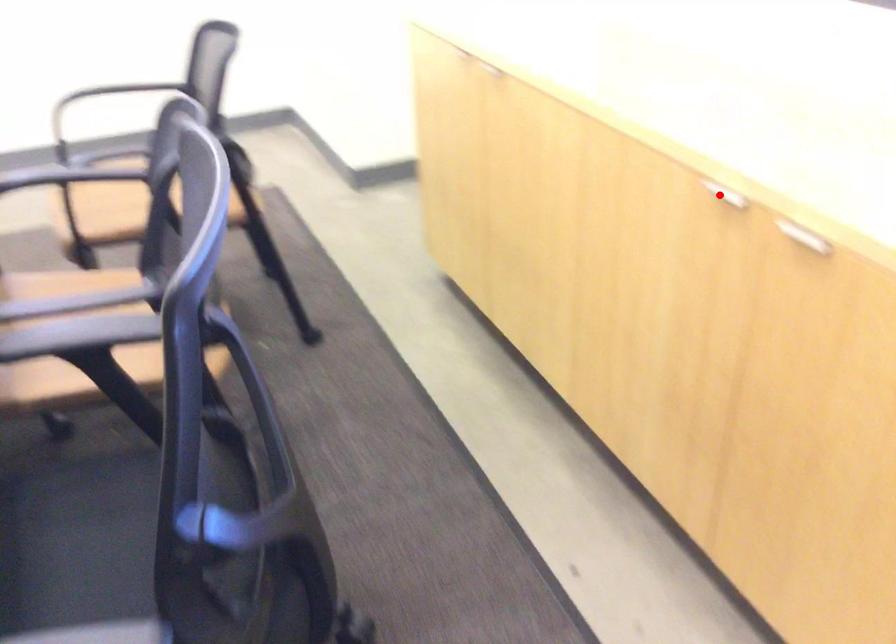
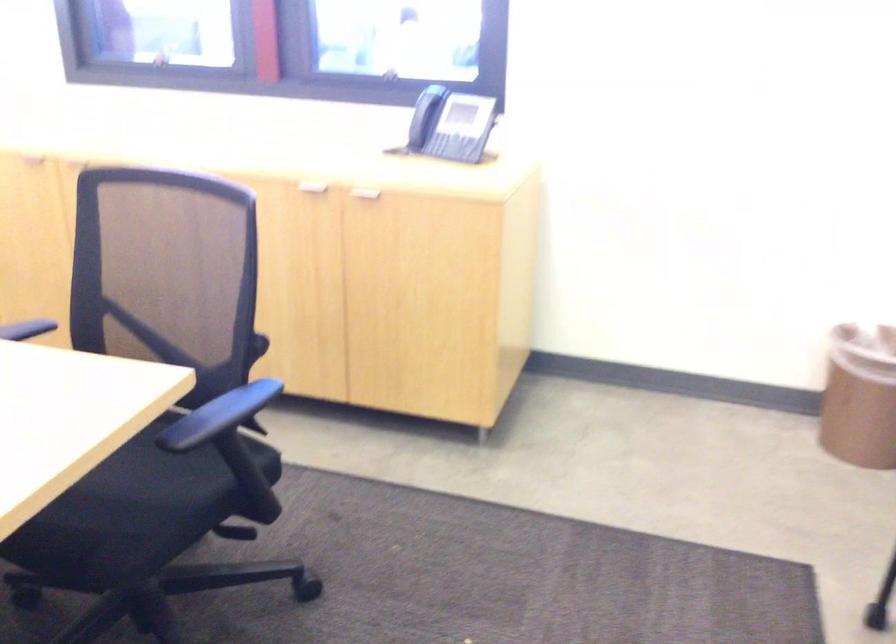
Question: A red point is marked in image1. In image2, is the corresponding 3D point closer to the camera or farther? Reply with the corresponding letter.

Choices:
 (A) The corresponding 3D point is closer.
 (B) The corresponding 3D point is farther.

Answer: (B)